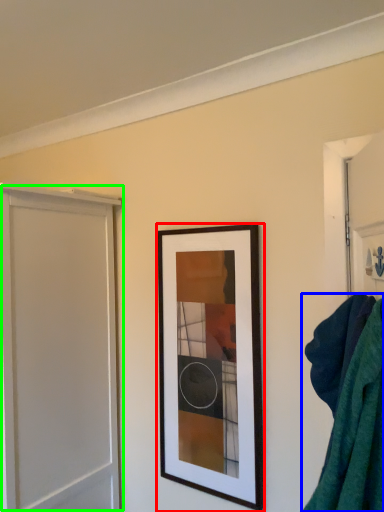
Question: Which object is positioned farthest from picture frame (highlighted by a red box)? Select from bath towel (highlighted by a blue box) and screen door (highlighted by a green box).

Choices:
 (A) bath towel
 (B) screen door

Answer: (A)